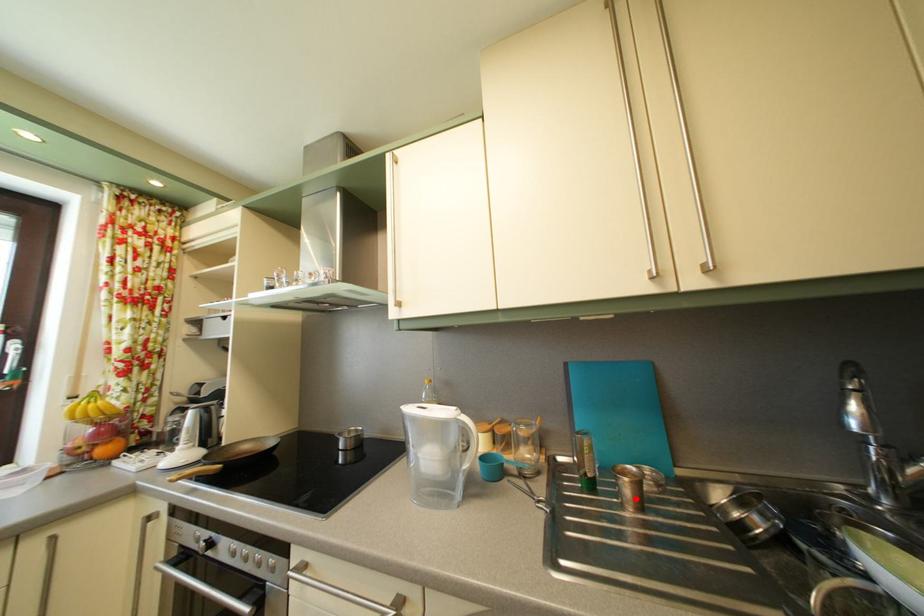
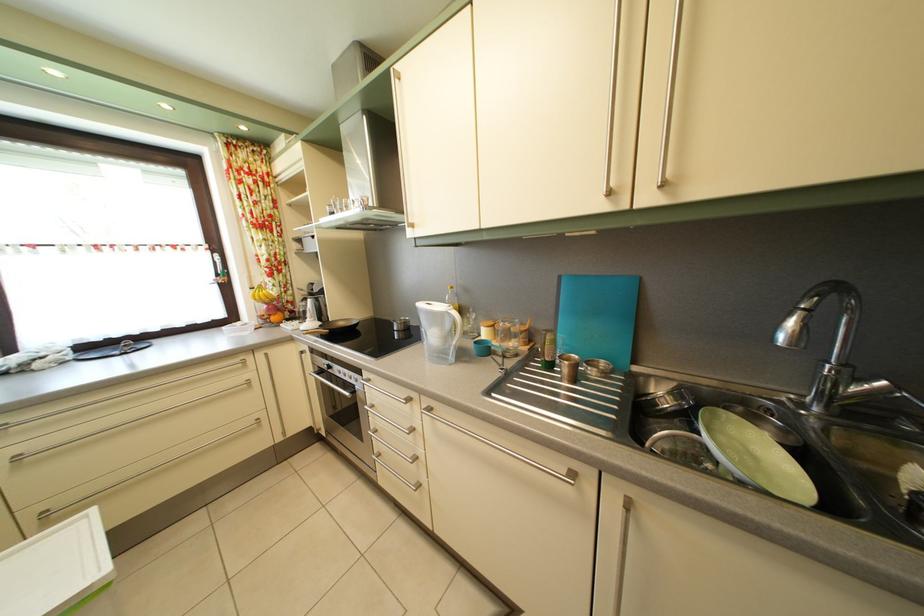
The point at the highlighted location is marked in the first image. Where is the corresponding point in the second image?

(574, 378)